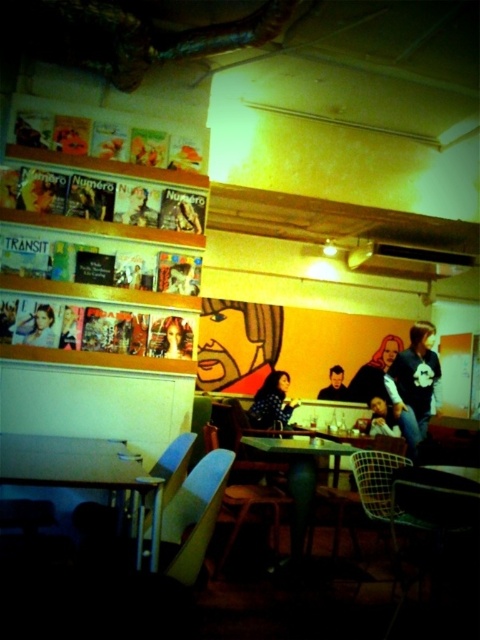
You are a customer entering the cafe and want to sit at the metallic silver table at lower left. However, you notice the smooth black shirt at center is placed on the table. Can you sit there comfortably?

The metallic silver table at lower left is much taller than the smooth black shirt at center. Since the table is taller, it should still be comfortable to sit there, though the shirt might need to be moved for more space.

You are a customer in the cafe and want to take a photo of the polka dot blouse at center. The cafe has a rule that you must stay at least 1 meter away from any displayed items. Given that the point representing the blouse is at coordinate point (272, 403), can you estimate if you can take the photo from your current position without violating the rule?

The polka dot blouse at center is represented by point (272, 403). The cafe requires staying at least 1 meter away from displayed items. Since the coordinate point does not provide distance information, it is impossible to determine if the required distance is maintained.

You are a customer in the cozy cafe and want to take a photo of the polka dot blouse at center without moving any objects. Where exactly should you position your camera to capture the blouse perfectly?

The polka dot blouse at center is located at point coordinates (272, 403), so position your camera at those coordinates to capture it perfectly.